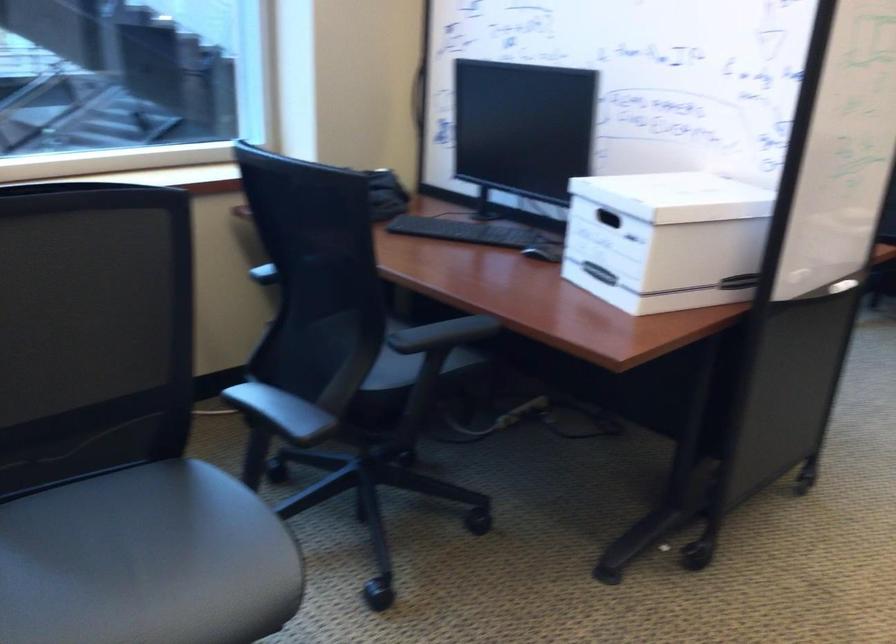
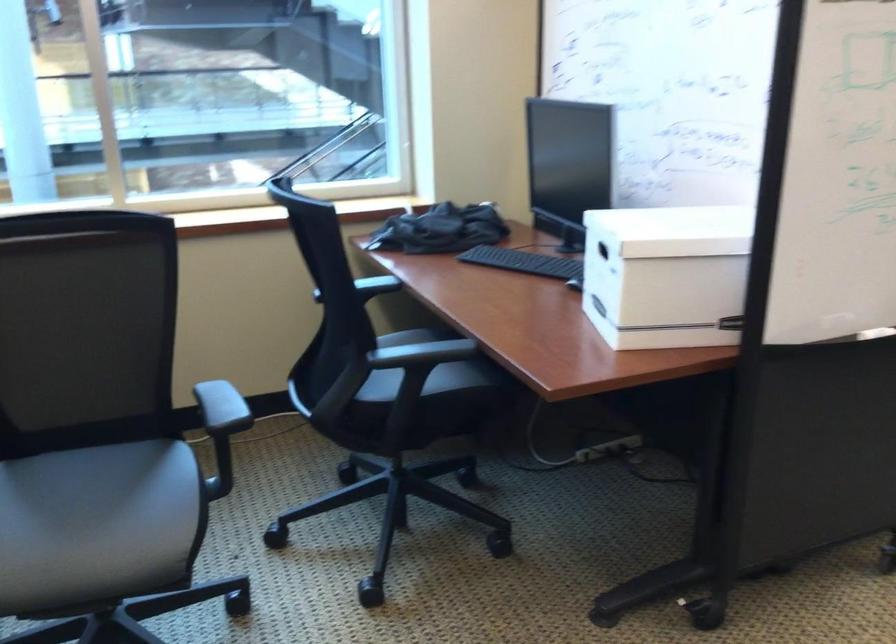
Question: What movement of the cameraman would produce the second image?

Choices:
 (A) Left
 (B) Right
 (C) Forward
 (D) Backward

Answer: (B)